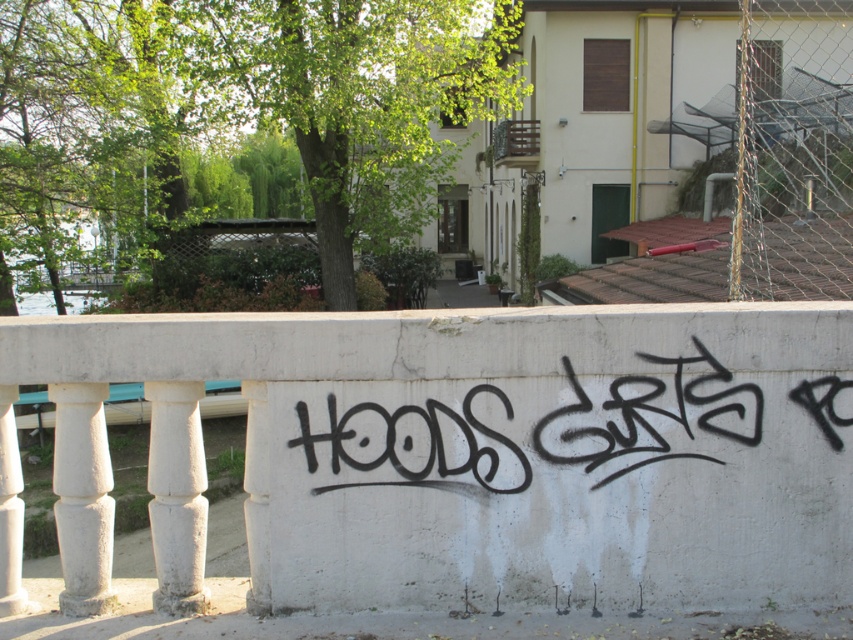
Question: Can you confirm if white concrete fence at center is thinner than black graffiti at center?

Choices:
 (A) yes
 (B) no

Answer: (B)

Question: Does white concrete fence at center lie in front of black graffiti at center?

Choices:
 (A) yes
 (B) no

Answer: (A)

Question: Is white concrete fence at center below black graffiti at center?

Choices:
 (A) no
 (B) yes

Answer: (B)

Question: Which point is closer to the camera?

Choices:
 (A) black graffiti at center
 (B) white concrete fence at center

Answer: (B)

Question: Which of the following is the farthest from the observer?

Choices:
 (A) (816, 536)
 (B) (471, 461)

Answer: (A)